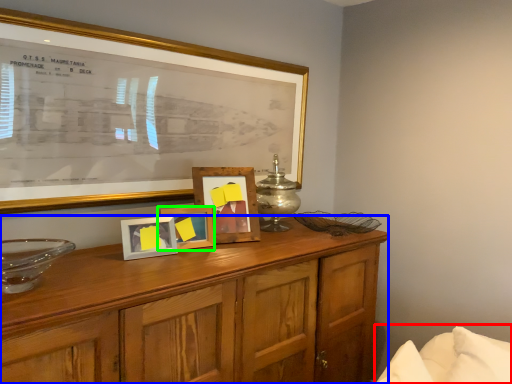
Question: Estimate the real-world distances between objects in this image. Which object is closer to bed (highlighted by a red box), cabinetry (highlighted by a blue box) or picture frame (highlighted by a green box)?

Choices:
 (A) cabinetry
 (B) picture frame

Answer: (A)